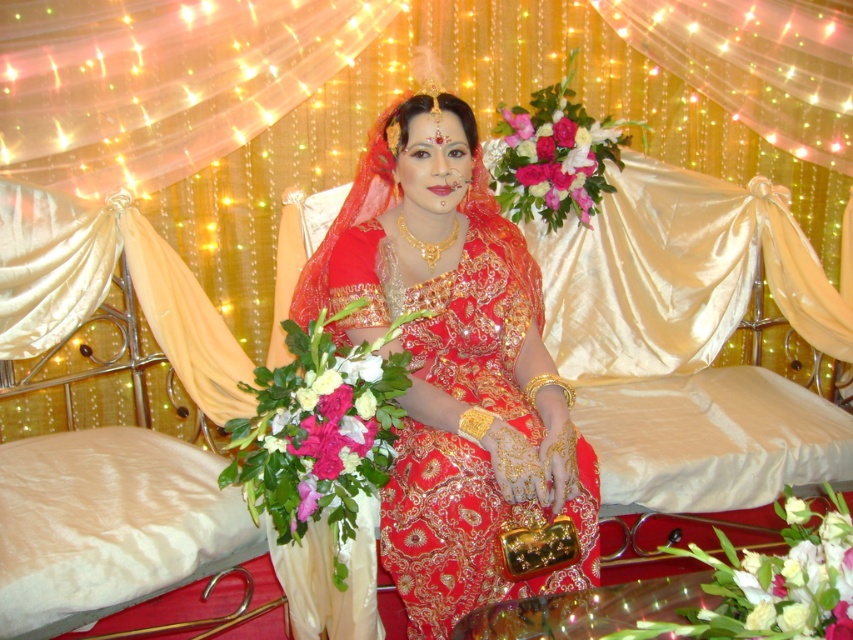
You are a photographer at the wedding and want to capture the pink silk flower at center and the pink silk bouquet at center in a single shot. Based on their positions, which one is closer to the camera?

The pink silk flower at center is located below the pink silk bouquet at center, so it is closer to the camera.

You are a photographer taking a closeup shot of the bride in the wedding scene. You want to focus on the matte gold jewelry at center and the pink silk bouquet at center. Which object should you adjust your camera focus to first to ensure it is in sharp focus?

The matte gold jewelry at center is closer to the viewer than the pink silk bouquet at center, so you should focus on the matte gold jewelry at center first.

You are a photographer at the wedding and want to capture a closeup of the pink silk flower at center and the pink silk bouquet at center. Which one should you focus on to ensure it appears larger in the photo?

The pink silk flower at center is closer to the viewer than the pink silk bouquet at center, so focusing on it will make it appear larger in the photo.